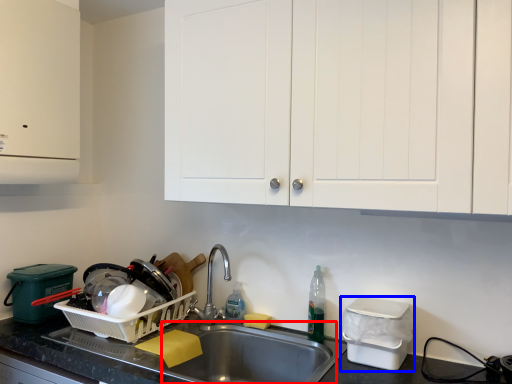
Question: Which point is further to the camera, sink (highlighted by a red box) or appliance (highlighted by a blue box)?

Choices:
 (A) sink
 (B) appliance

Answer: (B)